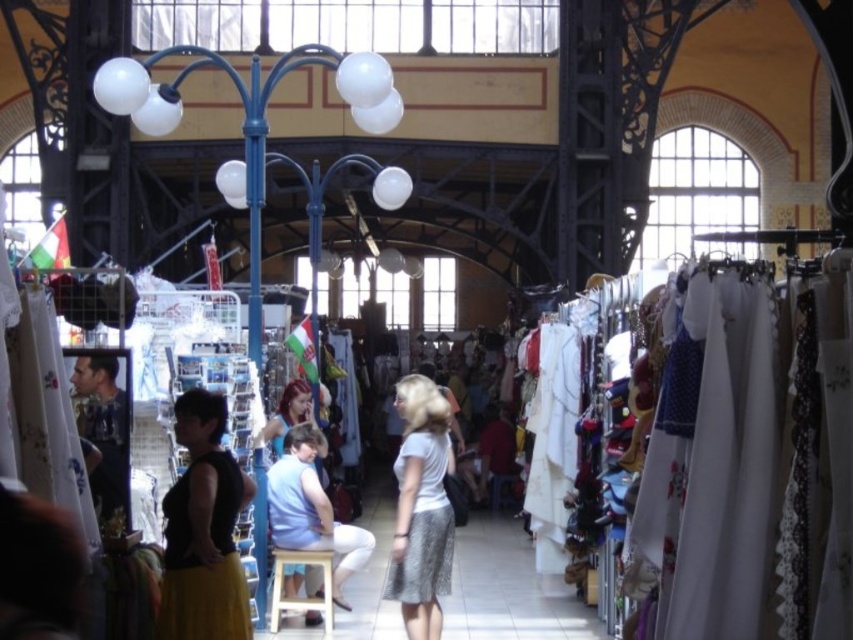
This screenshot has width=853, height=640. Describe the element at coordinates (311, 508) in the screenshot. I see `light blue fabric at center` at that location.

Where is `light blue fabric at center`? This screenshot has width=853, height=640. light blue fabric at center is located at coordinates (311, 508).

Between white lace skirt at center and light blue fabric at center, which one is positioned lower?

white lace skirt at center is below.

Between point (416, 477) and point (287, 531), which one is positioned in front?

Positioned in front is point (416, 477).

Is point (421, 620) closer to camera compared to point (315, 612)?

Yes, it is.

Where is `white lace skirt at center`? white lace skirt at center is located at coordinates (421, 508).

Where is `black matte tank top at center`? black matte tank top at center is located at coordinates (202, 529).

Who is more distant from viewer, (181, 582) or (296, 609)?

Positioned behind is point (296, 609).

This screenshot has width=853, height=640. What are the coordinates of `black matte tank top at center` in the screenshot? It's located at (202, 529).